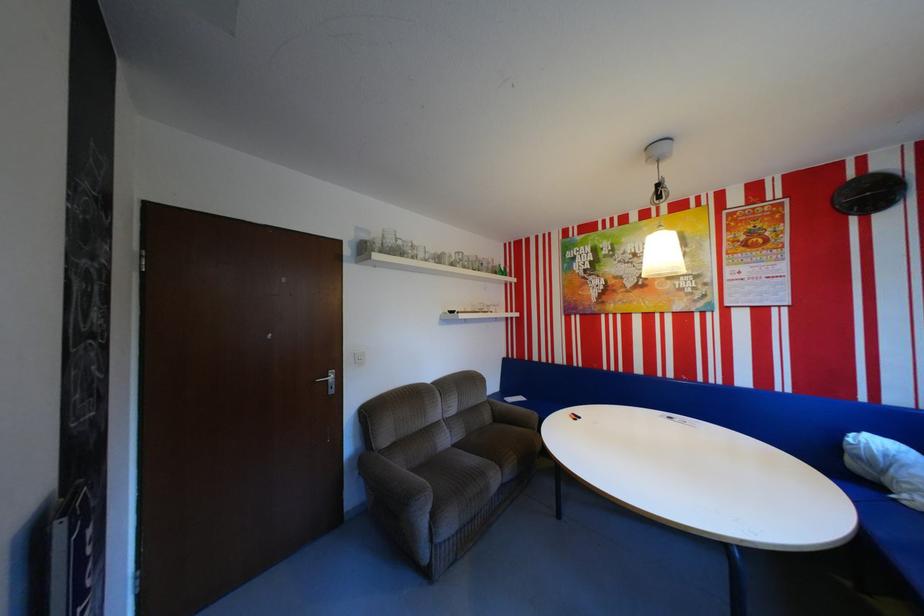
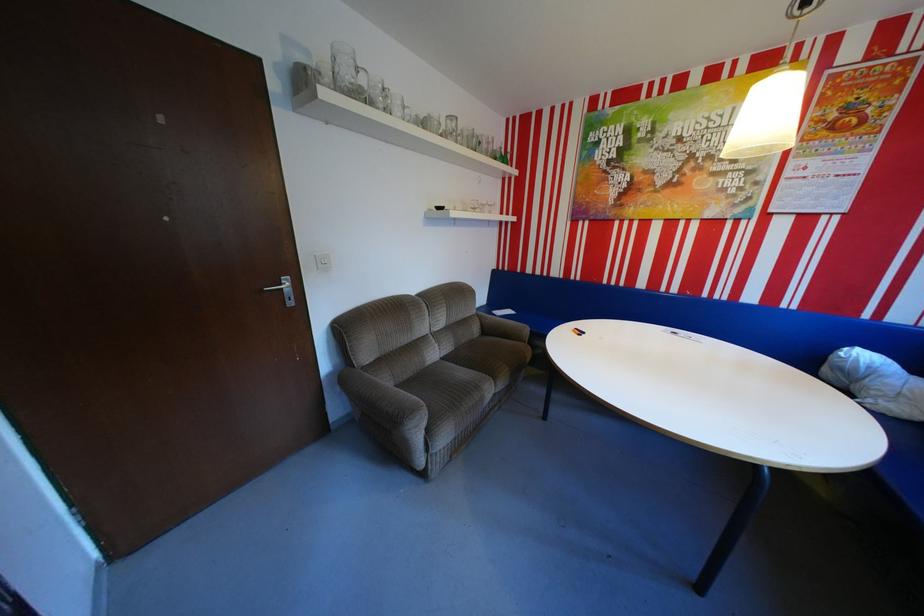
The point at (402, 240) is marked in the first image. Where is the corresponding point in the second image?

(359, 73)